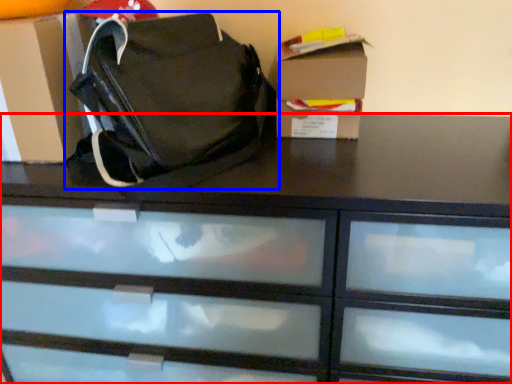
Question: Which object is further to the camera taking this photo, chest of drawers (highlighted by a red box) or handbag (highlighted by a blue box)?

Choices:
 (A) chest of drawers
 (B) handbag

Answer: (A)